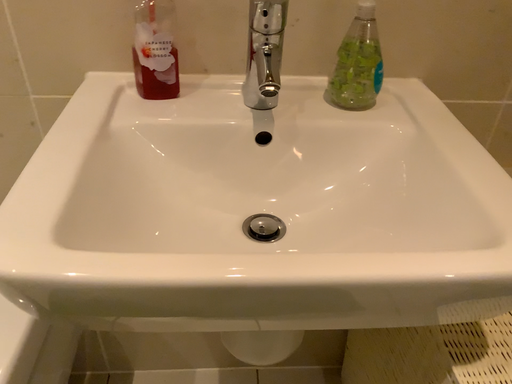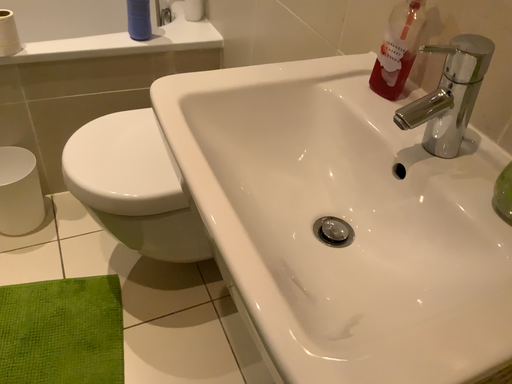
Question: How did the camera likely rotate when shooting the video?

Choices:
 (A) rotated downward
 (B) rotated upward

Answer: (B)